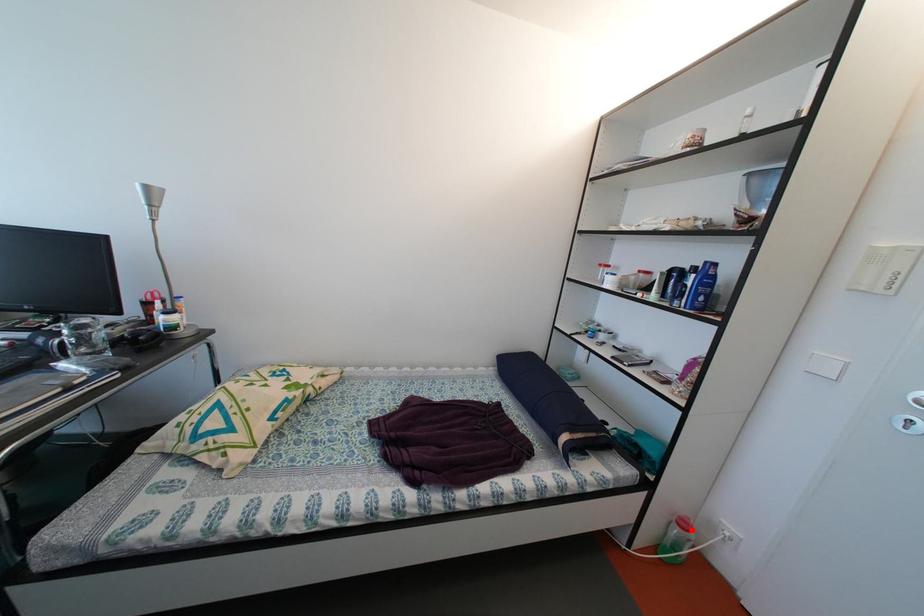
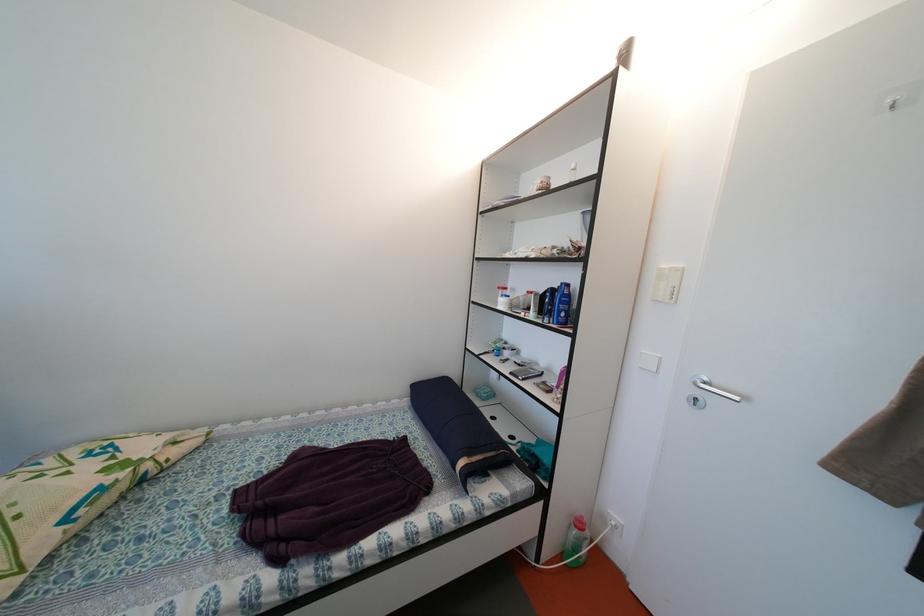
Question: I am providing you with two images of the same scene from different viewpoints. Image1 has a red point marked. In image2, the corresponding 3D location appears at what relative position? Reply with the corresponding letter.

Choices:
 (A) Closer
 (B) Farther

Answer: (B)